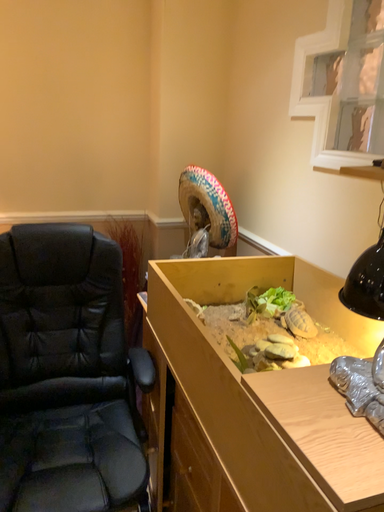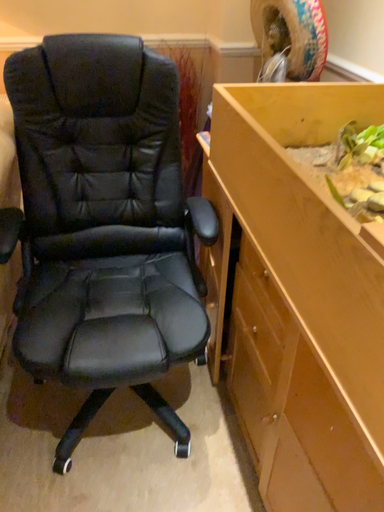
Question: Which way did the camera rotate in the video?

Choices:
 (A) rotated upward
 (B) rotated downward

Answer: (B)